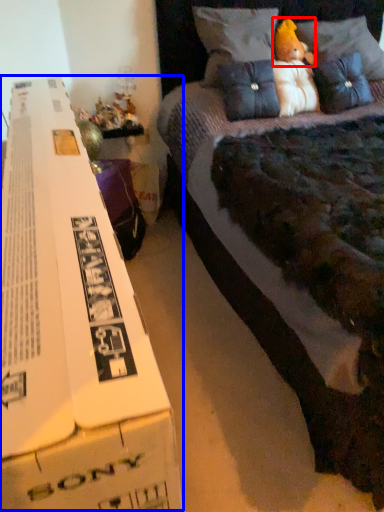
Question: Among these objects, which one is farthest to the camera, toy (highlighted by a red box) or paperback book (highlighted by a blue box)?

Choices:
 (A) toy
 (B) paperback book

Answer: (A)